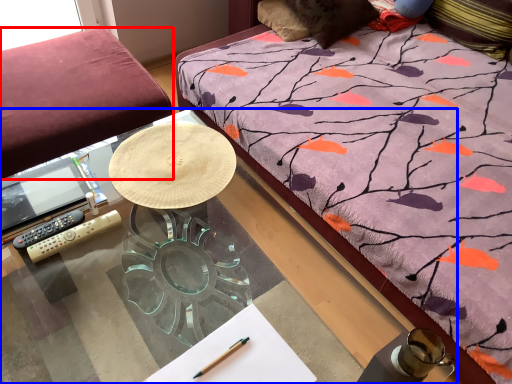
Question: Which of the following is the farthest to the observer, studio couch (highlighted by a red box) or desk (highlighted by a blue box)?

Choices:
 (A) studio couch
 (B) desk

Answer: (A)